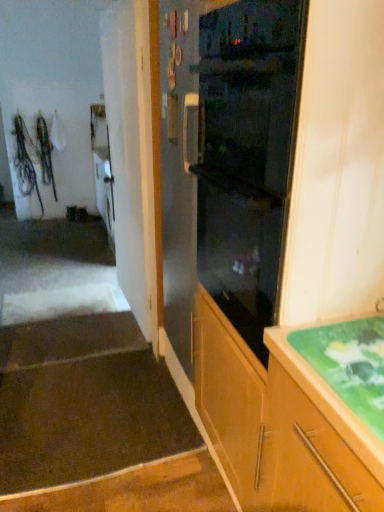
Question: Is black glass oven at center next to brown carpet at lower left, the 2th stairwell positioned from the front, and touching it?

Choices:
 (A) yes
 (B) no

Answer: (B)

Question: Considering the relative sizes of black glass oven at center and brown carpet at lower left, the 2th stairwell positioned from the front, in the image provided, is black glass oven at center bigger than brown carpet at lower left, the 2th stairwell positioned from the front,?

Choices:
 (A) yes
 (B) no

Answer: (A)

Question: From a real-world perspective, is black glass oven at center under brown carpet at lower left, the first stairwell in the back-to-front sequence?

Choices:
 (A) yes
 (B) no

Answer: (B)

Question: From the image's perspective, does black glass oven at center appear lower than brown carpet at lower left, the 2th stairwell positioned from the front?

Choices:
 (A) no
 (B) yes

Answer: (A)

Question: Is black glass oven at center outside of brown carpet at lower left, the 2th stairwell positioned from the front?

Choices:
 (A) yes
 (B) no

Answer: (A)

Question: From a real-world perspective, is black glass oven at center on top of brown carpet at lower left, the 2th stairwell positioned from the front?

Choices:
 (A) no
 (B) yes

Answer: (B)

Question: From a real-world perspective, is brown carpet at lower left, the first stairwell in the back-to-front sequence, positioned under dark brown carpet at lower left, positioned as the second stairwell in back-to-front order, based on gravity?

Choices:
 (A) no
 (B) yes

Answer: (B)

Question: Does brown carpet at lower left, the 2th stairwell positioned from the front, have a lesser height compared to dark brown carpet at lower left, positioned as the second stairwell in back-to-front order?

Choices:
 (A) yes
 (B) no

Answer: (A)

Question: Considering the relative positions of brown carpet at lower left, the first stairwell in the back-to-front sequence, and dark brown carpet at lower left, the first stairwell viewed from the front, in the image provided, is brown carpet at lower left, the first stairwell in the back-to-front sequence, to the right of dark brown carpet at lower left, the first stairwell viewed from the front, from the viewer's perspective?

Choices:
 (A) yes
 (B) no

Answer: (B)

Question: From the image's perspective, would you say brown carpet at lower left, the first stairwell in the back-to-front sequence, is positioned over dark brown carpet at lower left, the first stairwell viewed from the front?

Choices:
 (A) yes
 (B) no

Answer: (A)

Question: Is brown carpet at lower left, the 2th stairwell positioned from the front, aimed at dark brown carpet at lower left, positioned as the second stairwell in back-to-front order?

Choices:
 (A) no
 (B) yes

Answer: (A)

Question: Can you confirm if brown carpet at lower left, the first stairwell in the back-to-front sequence, is bigger than dark brown carpet at lower left, the first stairwell viewed from the front?

Choices:
 (A) yes
 (B) no

Answer: (B)

Question: Are dark brown carpet at lower left, the first stairwell viewed from the front, and brown carpet at lower left, the first stairwell in the back-to-front sequence, beside each other?

Choices:
 (A) yes
 (B) no

Answer: (B)